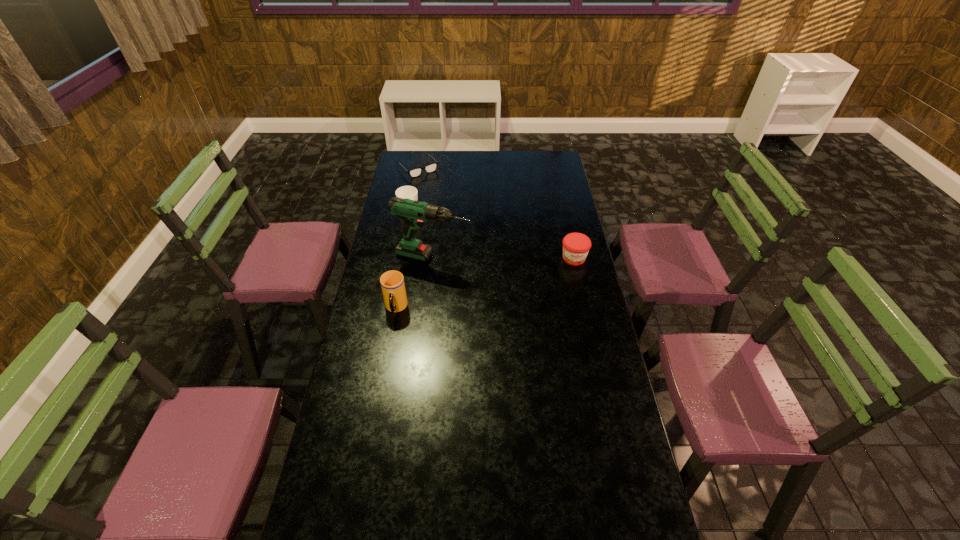
The image size is (960, 540). What are the coordinates of `vacant space on the desktop that is between the second tallest object and the jam and is positioned with the handle on the side of the second farthest object` in the screenshot? It's located at (478, 285).

This screenshot has width=960, height=540. I want to click on free space on the desktop that is between the nearest object and the rightmost object and is positioned on the handle side of the drill, so click(x=513, y=275).

Find the location of a particular element. This screenshot has height=540, width=960. vacant space on the desktop that is between the nearer cup and the jam and is positioned on the front-facing side of the spectacles is located at coordinates (516, 275).